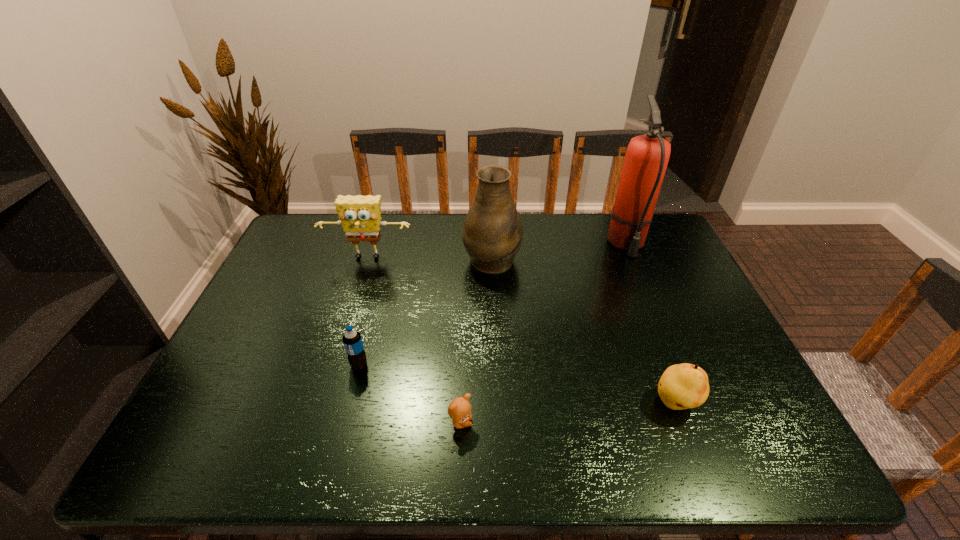
Image resolution: width=960 pixels, height=540 pixels. In order to click on object at the far left corner in this screenshot , I will do `click(359, 215)`.

Find the location of a particular element. The image size is (960, 540). object at the far right corner is located at coordinates (646, 158).

This screenshot has height=540, width=960. Identify the location of free point at the far edge. (405, 239).

At what (x,y) coordinates should I click in order to perform the action: click on free location at the left edge. Please return your answer as a coordinate pair (x, y). The image size is (960, 540). Looking at the image, I should click on (300, 256).

Where is `free space at the right edge of the desktop`? The image size is (960, 540). free space at the right edge of the desktop is located at coordinates (713, 365).

Where is `vacant region at the far left corner of the desktop`? Image resolution: width=960 pixels, height=540 pixels. vacant region at the far left corner of the desktop is located at coordinates (286, 240).

Where is `vacant area at the far right corner`? vacant area at the far right corner is located at coordinates (668, 234).

Where is `blank space at the near right corner`? This screenshot has width=960, height=540. blank space at the near right corner is located at coordinates (788, 468).

Find the location of `vacant area between the fifth shortest object and the teddy bear`. vacant area between the fifth shortest object and the teddy bear is located at coordinates (476, 340).

Where is `unoccupied position between the pear and the teddy bear`? unoccupied position between the pear and the teddy bear is located at coordinates (568, 413).